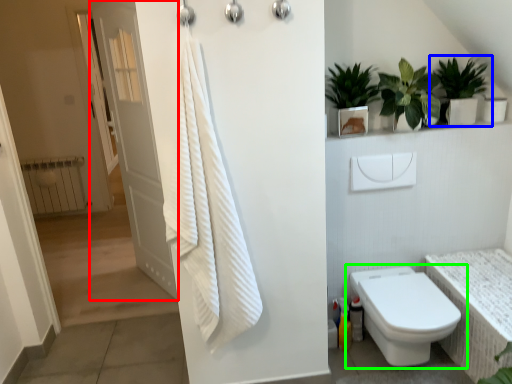
Question: Which object is the closest to the door (highlighted by a red box)? Choose among these: houseplant (highlighted by a blue box) or toilet (highlighted by a green box).

Choices:
 (A) houseplant
 (B) toilet

Answer: (B)